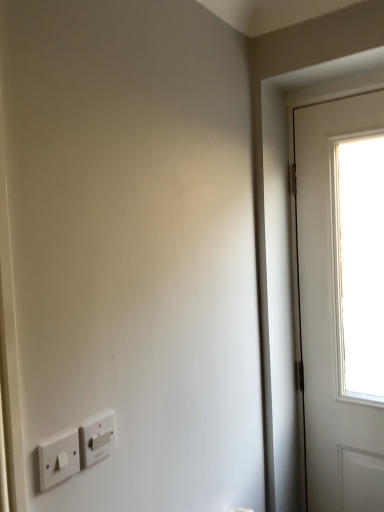
Identify the location of white plastic light switch at lower left, which is counted as the first light switch, starting from the right. (97, 439).

Measure the distance between white plastic light switch at lower left, which ranks as the 2th light switch in left-to-right order, and camera.

32.85 inches.

This screenshot has height=512, width=384. What do you see at coordinates (97, 439) in the screenshot?
I see `white plastic light switch at lower left, which ranks as the first light switch in back-to-front order` at bounding box center [97, 439].

The image size is (384, 512). Describe the element at coordinates (58, 459) in the screenshot. I see `white plastic light switch at lower left, which is the 1th light switch in front-to-back order` at that location.

Where is `white plastic light switch at lower left, which is the 1th light switch in front-to-back order`? Image resolution: width=384 pixels, height=512 pixels. white plastic light switch at lower left, which is the 1th light switch in front-to-back order is located at coordinates (58, 459).

Identify the location of white plastic light switch at lower left, the second light switch when ordered from front to back. The image size is (384, 512). (97, 439).

Considering the positions of objects white plastic light switch at lower left, which ranks as the 2th light switch in left-to-right order, and white plastic light switch at lower left, which is the 1th light switch in front-to-back order, in the image provided, who is more to the right, white plastic light switch at lower left, which ranks as the 2th light switch in left-to-right order, or white plastic light switch at lower left, which is the 1th light switch in front-to-back order,?

From the viewer's perspective, white plastic light switch at lower left, which ranks as the 2th light switch in left-to-right order, appears more on the right side.

Considering the positions of objects white plastic light switch at lower left, which ranks as the 2th light switch in left-to-right order, and white plastic light switch at lower left, which is the 1th light switch in front-to-back order, in the image provided, who is behind, white plastic light switch at lower left, which ranks as the 2th light switch in left-to-right order, or white plastic light switch at lower left, which is the 1th light switch in front-to-back order,?

white plastic light switch at lower left, which ranks as the 2th light switch in left-to-right order, is further from the camera.

From the picture: Which point is more forward, (107,420) or (60,459)?

Point (60,459)

From the image's perspective, is white plastic light switch at lower left, the second light switch when ordered from front to back, positioned above or below white plastic light switch at lower left, which is the 1th light switch in front-to-back order?

From the image's perspective, white plastic light switch at lower left, the second light switch when ordered from front to back, appears above white plastic light switch at lower left, which is the 1th light switch in front-to-back order.

From a real-world perspective, which object stands above the other?

white plastic light switch at lower left, which is the 1th light switch in front-to-back order.

Is white plastic light switch at lower left, the second light switch when ordered from front to back, wider or thinner than white plastic light switch at lower left, which is the 1th light switch in front-to-back order?

Considering their sizes, white plastic light switch at lower left, the second light switch when ordered from front to back, looks broader than white plastic light switch at lower left, which is the 1th light switch in front-to-back order.

Considering the sizes of objects white plastic light switch at lower left, which ranks as the first light switch in back-to-front order, and white plastic light switch at lower left, which appears as the 2th light switch when viewed from the right, in the image provided, who is taller, white plastic light switch at lower left, which ranks as the first light switch in back-to-front order, or white plastic light switch at lower left, which appears as the 2th light switch when viewed from the right,?

Standing taller between the two is white plastic light switch at lower left, which ranks as the first light switch in back-to-front order.

Looking at the image, does white plastic light switch at lower left, which ranks as the 2th light switch in left-to-right order, seem bigger or smaller compared to white plastic light switch at lower left, which appears as the 2th light switch when viewed from the right?

In the image, white plastic light switch at lower left, which ranks as the 2th light switch in left-to-right order, appears to be smaller than white plastic light switch at lower left, which appears as the 2th light switch when viewed from the right.

Is white plastic light switch at lower left, which ranks as the 2th light switch in left-to-right order, positioned beyond the bounds of white plastic light switch at lower left, which ranks as the 1th light switch in left-to-right order?

white plastic light switch at lower left, which ranks as the 2th light switch in left-to-right order, is positioned outside white plastic light switch at lower left, which ranks as the 1th light switch in left-to-right order.

Is white plastic light switch at lower left, which ranks as the first light switch in back-to-front order, not near white plastic light switch at lower left, which ranks as the 1th light switch in left-to-right order?

No, white plastic light switch at lower left, which ranks as the first light switch in back-to-front order, is not far from white plastic light switch at lower left, which ranks as the 1th light switch in left-to-right order.

Could you tell me if white plastic light switch at lower left, which ranks as the first light switch in back-to-front order, is facing white plastic light switch at lower left, which is the 1th light switch in front-to-back order?

No, white plastic light switch at lower left, which ranks as the first light switch in back-to-front order, is not oriented towards white plastic light switch at lower left, which is the 1th light switch in front-to-back order.

Find the location of a particular element. Image resolution: width=384 pixels, height=512 pixels. light switch on the left of white plastic light switch at lower left, which is counted as the first light switch, starting from the right is located at coordinates (58, 459).

Does white plastic light switch at lower left, which appears as the 2th light switch when viewed from the right, appear on the left side of white plastic light switch at lower left, which ranks as the first light switch in back-to-front order?

Yes.

Does white plastic light switch at lower left, which is the 1th light switch in front-to-back order, come behind white plastic light switch at lower left, the second light switch when ordered from front to back?

No, it is not.

Is point (62, 442) positioned in front of point (89, 420)?

Yes, point (62, 442) is closer to viewer.

From the image's perspective, is white plastic light switch at lower left, which is the 1th light switch in front-to-back order, on top of white plastic light switch at lower left, which is counted as the first light switch, starting from the right?

Incorrect, from the image's perspective, white plastic light switch at lower left, which is the 1th light switch in front-to-back order, is lower than white plastic light switch at lower left, which is counted as the first light switch, starting from the right.

From a real-world perspective, is white plastic light switch at lower left, which appears as the 2th light switch when viewed from the right, located higher than white plastic light switch at lower left, the second light switch when ordered from front to back?

Correct, in the physical world, white plastic light switch at lower left, which appears as the 2th light switch when viewed from the right, is higher than white plastic light switch at lower left, the second light switch when ordered from front to back.

Considering the relative sizes of white plastic light switch at lower left, the second light switch viewed from the back, and white plastic light switch at lower left, which ranks as the 2th light switch in left-to-right order, in the image provided, is white plastic light switch at lower left, the second light switch viewed from the back, wider than white plastic light switch at lower left, which ranks as the 2th light switch in left-to-right order,?

No, white plastic light switch at lower left, the second light switch viewed from the back, is not wider than white plastic light switch at lower left, which ranks as the 2th light switch in left-to-right order.

Can you confirm if white plastic light switch at lower left, which appears as the 2th light switch when viewed from the right, is shorter than white plastic light switch at lower left, which is counted as the first light switch, starting from the right?

Correct, white plastic light switch at lower left, which appears as the 2th light switch when viewed from the right, is not as tall as white plastic light switch at lower left, which is counted as the first light switch, starting from the right.

Considering the relative sizes of white plastic light switch at lower left, which appears as the 2th light switch when viewed from the right, and white plastic light switch at lower left, the second light switch when ordered from front to back, in the image provided, is white plastic light switch at lower left, which appears as the 2th light switch when viewed from the right, smaller than white plastic light switch at lower left, the second light switch when ordered from front to back,?

Actually, white plastic light switch at lower left, which appears as the 2th light switch when viewed from the right, might be larger than white plastic light switch at lower left, the second light switch when ordered from front to back.

Would you say white plastic light switch at lower left, which ranks as the first light switch in back-to-front order, is part of white plastic light switch at lower left, which appears as the 2th light switch when viewed from the right,'s contents?

No, white plastic light switch at lower left, which ranks as the first light switch in back-to-front order, is not a part of white plastic light switch at lower left, which appears as the 2th light switch when viewed from the right.

Would you say white plastic light switch at lower left, which appears as the 2th light switch when viewed from the right, is a long distance from white plastic light switch at lower left, which is counted as the first light switch, starting from the right?

No, white plastic light switch at lower left, which appears as the 2th light switch when viewed from the right, is not far away from white plastic light switch at lower left, which is counted as the first light switch, starting from the right.

Is white plastic light switch at lower left, the second light switch viewed from the back, oriented away from white plastic light switch at lower left, which is counted as the first light switch, starting from the right?

No, white plastic light switch at lower left, which is counted as the first light switch, starting from the right, is not at the back of white plastic light switch at lower left, the second light switch viewed from the back.

Can you tell me how much white plastic light switch at lower left, which appears as the 2th light switch when viewed from the right, and white plastic light switch at lower left, the second light switch when ordered from front to back, differ in facing direction?

The angular difference between white plastic light switch at lower left, which appears as the 2th light switch when viewed from the right, and white plastic light switch at lower left, the second light switch when ordered from front to back, is 0.83 degrees.

The width and height of the screenshot is (384, 512). Find the location of `light switch that appears on the left of white plastic light switch at lower left, the second light switch when ordered from front to back`. light switch that appears on the left of white plastic light switch at lower left, the second light switch when ordered from front to back is located at coordinates (58, 459).

Identify the location of light switch above the white plastic light switch at lower left, which is counted as the first light switch, starting from the right (from a real-world perspective). (58, 459).

Where is `light switch that is below the white plastic light switch at lower left, which is counted as the first light switch, starting from the right (from the image's perspective)`? The width and height of the screenshot is (384, 512). light switch that is below the white plastic light switch at lower left, which is counted as the first light switch, starting from the right (from the image's perspective) is located at coordinates (58, 459).